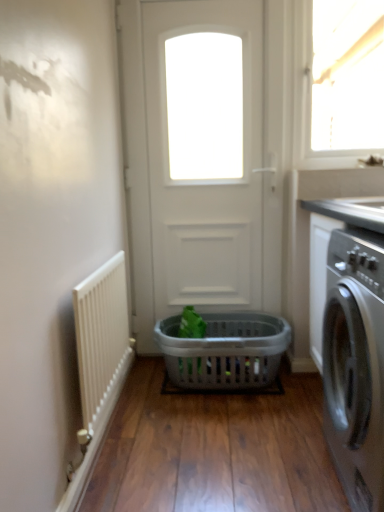
Question: Considering the positions of point (125, 349) and point (135, 333), is point (125, 349) closer or farther from the camera than point (135, 333)?

Choices:
 (A) closer
 (B) farther

Answer: (A)

Question: From the image's perspective, is white textured radiator at left located above or below white matte door at center?

Choices:
 (A) below
 (B) above

Answer: (A)

Question: Considering the real-world distances, which object is farthest from the gray plastic basket at center?

Choices:
 (A) white textured radiator at left
 (B) satin black washing machine at right
 (C) white matte door at center
 (D) transparent glass window at upper right

Answer: (D)

Question: Which object is positioned farthest from the white matte door at center?

Choices:
 (A) satin black washing machine at right
 (B) gray plastic basket at center
 (C) white textured radiator at left
 (D) transparent glass window at upper right

Answer: (A)